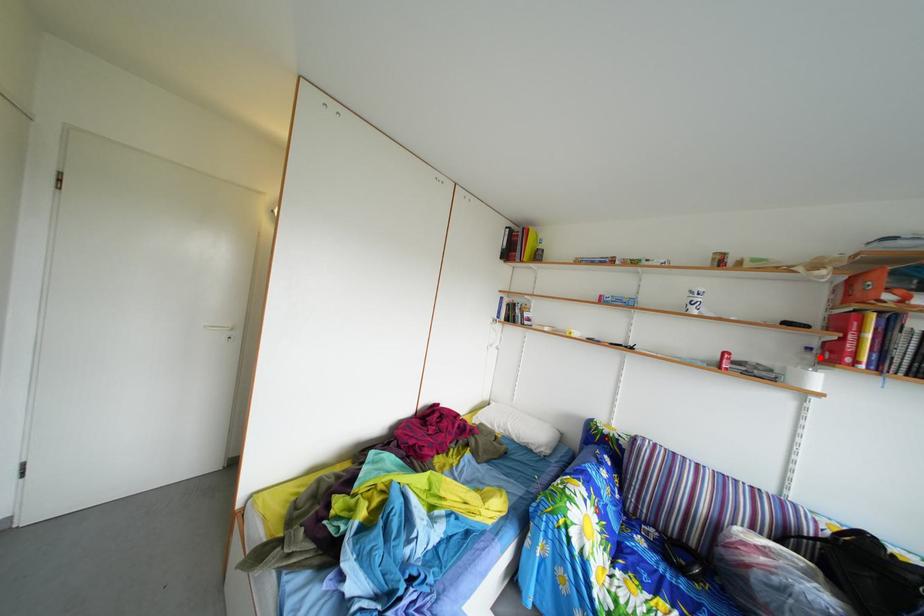
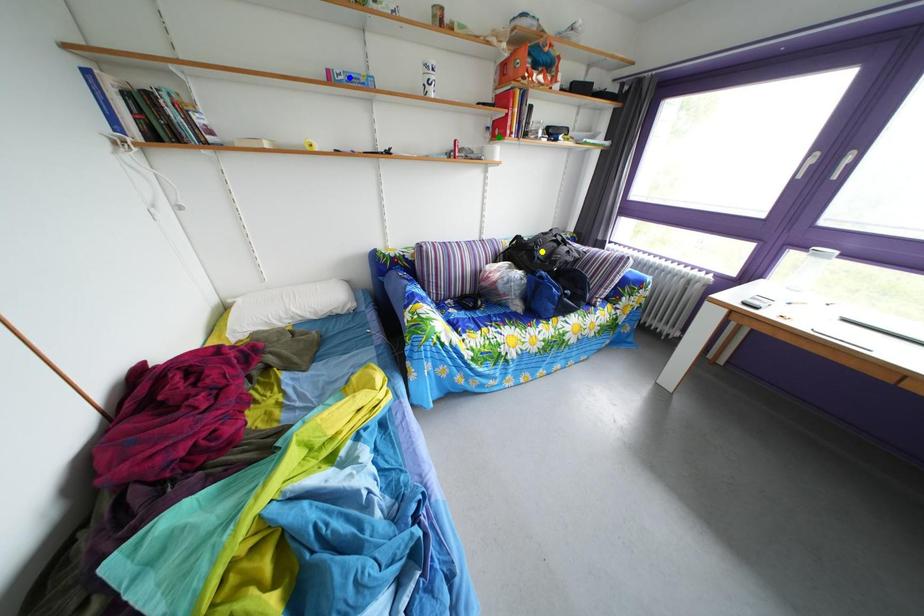
Question: I am providing you with two images of the same scene from different viewpoints. A red point is marked on the first image. You are given multiple points on the second image. In image 2, which mark is for the same physical point as the one in image 1?

Choices:
 (A) green point
 (B) yellow point
 (C) blue point

Answer: (A)